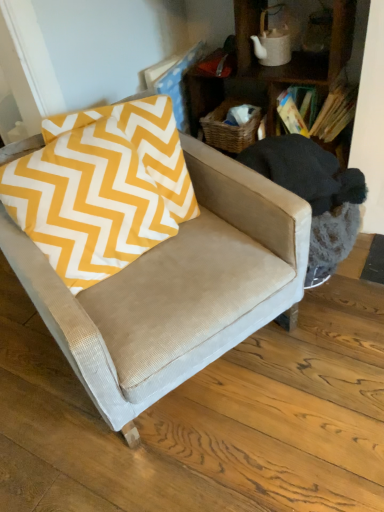
Describe the element at coordinates (102, 189) in the screenshot. This screenshot has height=512, width=384. I see `yellow zigzag fabric pillow at left` at that location.

The height and width of the screenshot is (512, 384). Describe the element at coordinates (297, 54) in the screenshot. I see `wooden bookshelf at upper right` at that location.

The height and width of the screenshot is (512, 384). In order to click on suede-like beige swivel chair at center in this screenshot , I will do tap(314, 194).

Is suede-like beige swivel chair at center positioned with its back to suede-like beige armchair at center?

No, suede-like beige swivel chair at center's orientation is not away from suede-like beige armchair at center.

Considering the relative positions of suede-like beige swivel chair at center and suede-like beige armchair at center in the image provided, is suede-like beige swivel chair at center to the right of suede-like beige armchair at center from the viewer's perspective?

Yes.

How different are the orientations of suede-like beige swivel chair at center and suede-like beige armchair at center in degrees?

They differ by 8.76 degrees in their facing directions.

Is suede-like beige swivel chair at center situated inside suede-like beige armchair at center or outside?

suede-like beige swivel chair at center is located beyond the bounds of suede-like beige armchair at center.

Is point (290, 288) positioned after point (347, 0)?

No, it is in front of (347, 0).

From the image's perspective, relative to wooden bookshelf at upper right, is suede-like beige armchair at center above or below?

suede-like beige armchair at center is situated lower than wooden bookshelf at upper right in the image.

I want to click on chair below the wooden bookshelf at upper right (from the image's perspective), so click(175, 289).

Who is smaller, suede-like beige armchair at center or wooden bookshelf at upper right?

With smaller size is wooden bookshelf at upper right.

Is yellow zigzag fabric pillow at left not near suede-like beige armchair at center?

They are positioned close to each other.

From the image's perspective, is yellow zigzag fabric pillow at left located beneath suede-like beige armchair at center?

Actually, yellow zigzag fabric pillow at left appears above suede-like beige armchair at center in the image.

Is yellow zigzag fabric pillow at left located outside suede-like beige armchair at center?

No.

Considering the relative sizes of suede-like beige armchair at center and suede-like beige swivel chair at center in the image provided, is suede-like beige armchair at center bigger than suede-like beige swivel chair at center?

Yes.

Is suede-like beige swivel chair at center located within suede-like beige armchair at center?

No, suede-like beige armchair at center does not contain suede-like beige swivel chair at center.

Between suede-like beige armchair at center and suede-like beige swivel chair at center, which one has less height?

With less height is suede-like beige swivel chair at center.

Are suede-like beige armchair at center and suede-like beige swivel chair at center making contact?

suede-like beige armchair at center and suede-like beige swivel chair at center are clearly separated.

The width and height of the screenshot is (384, 512). Find the location of `pillow above the suede-like beige swivel chair at center (from a real-world perspective)`. pillow above the suede-like beige swivel chair at center (from a real-world perspective) is located at coordinates (102, 189).

Considering the relative positions of yellow zigzag fabric pillow at left and suede-like beige swivel chair at center in the image provided, is yellow zigzag fabric pillow at left to the left of suede-like beige swivel chair at center from the viewer's perspective?

Correct, you'll find yellow zigzag fabric pillow at left to the left of suede-like beige swivel chair at center.

From the image's perspective, is yellow zigzag fabric pillow at left located above suede-like beige swivel chair at center?

Yes, from the image's perspective, yellow zigzag fabric pillow at left is on top of suede-like beige swivel chair at center.

Is yellow zigzag fabric pillow at left further to camera compared to suede-like beige swivel chair at center?

No.

Is wooden bookshelf at upper right positioned with its back to yellow zigzag fabric pillow at left?

That's not correct — wooden bookshelf at upper right is not looking away from yellow zigzag fabric pillow at left.

In terms of height, does wooden bookshelf at upper right look taller or shorter compared to yellow zigzag fabric pillow at left?

Clearly, wooden bookshelf at upper right is taller compared to yellow zigzag fabric pillow at left.

Looking at the image, does wooden bookshelf at upper right seem bigger or smaller compared to yellow zigzag fabric pillow at left?

Clearly, wooden bookshelf at upper right is larger in size than yellow zigzag fabric pillow at left.

Find the location of a particular element. Image resolution: width=384 pixels, height=512 pixels. bookcase above the yellow zigzag fabric pillow at left (from the image's perspective) is located at coordinates (297, 54).

How different are the orientations of suede-like beige armchair at center and yellow zigzag fabric pillow at left in degrees?

They differ by 1.46 degrees in their facing directions.

Based on the photo, could you tell me if suede-like beige armchair at center is turned towards yellow zigzag fabric pillow at left?

No, suede-like beige armchair at center is not turned towards yellow zigzag fabric pillow at left.

At what (x,y) coordinates should I click in order to perform the action: click on pillow that appears on the left of suede-like beige armchair at center. Please return your answer as a coordinate pair (x, y). Image resolution: width=384 pixels, height=512 pixels. Looking at the image, I should click on (102, 189).

Identify the location of chair in front of the suede-like beige swivel chair at center. The height and width of the screenshot is (512, 384). (175, 289).

Locate an element on the screen. The image size is (384, 512). bookcase on the right of suede-like beige armchair at center is located at coordinates (297, 54).

Based on their spatial positions, is yellow zigzag fabric pillow at left or suede-like beige swivel chair at center closer to wooden bookshelf at upper right?

suede-like beige swivel chair at center.

Considering their positions, is suede-like beige swivel chair at center positioned closer to suede-like beige armchair at center than yellow zigzag fabric pillow at left?

Based on the image, yellow zigzag fabric pillow at left appears to be nearer to suede-like beige armchair at center.

Looking at the image, which one is located further to yellow zigzag fabric pillow at left, wooden bookshelf at upper right or suede-like beige swivel chair at center?

Based on the image, wooden bookshelf at upper right appears to be further to yellow zigzag fabric pillow at left.

From the picture: Estimate the real-world distances between objects in this image. Which object is closer to wooden bookshelf at upper right, suede-like beige swivel chair at center or suede-like beige armchair at center?

suede-like beige swivel chair at center is closer to wooden bookshelf at upper right.

Which object lies nearer to the anchor point suede-like beige swivel chair at center, wooden bookshelf at upper right or suede-like beige armchair at center?

suede-like beige armchair at center is positioned closer to the anchor suede-like beige swivel chair at center.

Estimate the real-world distances between objects in this image. Which object is further from wooden bookshelf at upper right, suede-like beige armchair at center or yellow zigzag fabric pillow at left?

suede-like beige armchair at center is positioned further to the anchor wooden bookshelf at upper right.

Considering their positions, is suede-like beige armchair at center positioned further to yellow zigzag fabric pillow at left than suede-like beige swivel chair at center?

suede-like beige swivel chair at center lies further to yellow zigzag fabric pillow at left than the other object.

From the image, which object appears to be nearer to yellow zigzag fabric pillow at left, suede-like beige swivel chair at center or suede-like beige armchair at center?

suede-like beige armchair at center.

Locate an element on the screen. The height and width of the screenshot is (512, 384). chair situated between yellow zigzag fabric pillow at left and suede-like beige swivel chair at center from left to right is located at coordinates (175, 289).

Locate an element on the screen. The image size is (384, 512). bookcase between yellow zigzag fabric pillow at left and suede-like beige swivel chair at center is located at coordinates (297, 54).

Locate an element on the screen. The width and height of the screenshot is (384, 512). swivel chair that lies between wooden bookshelf at upper right and suede-like beige armchair at center from top to bottom is located at coordinates (314, 194).

Image resolution: width=384 pixels, height=512 pixels. Find the location of `pillow that lies between wooden bookshelf at upper right and suede-like beige armchair at center from top to bottom`. pillow that lies between wooden bookshelf at upper right and suede-like beige armchair at center from top to bottom is located at coordinates (102, 189).